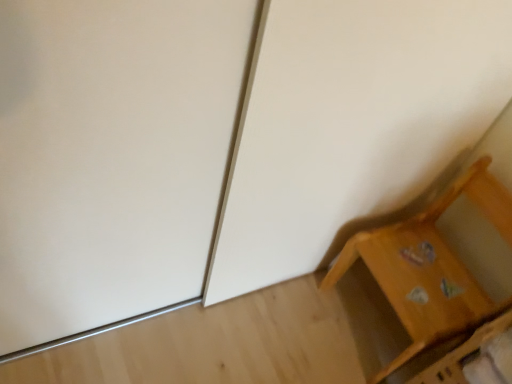
This screenshot has width=512, height=384. What do you see at coordinates (431, 267) in the screenshot? I see `wooden chair at lower right` at bounding box center [431, 267].

Locate an element on the screen. wooden chair at lower right is located at coordinates (431, 267).

Where is `wooden chair at lower right`? Image resolution: width=512 pixels, height=384 pixels. wooden chair at lower right is located at coordinates (431, 267).